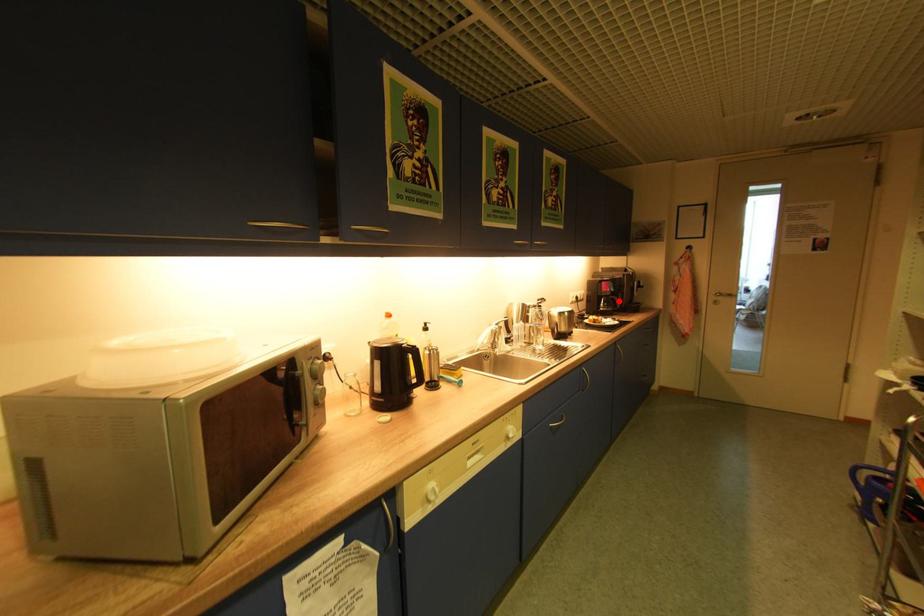
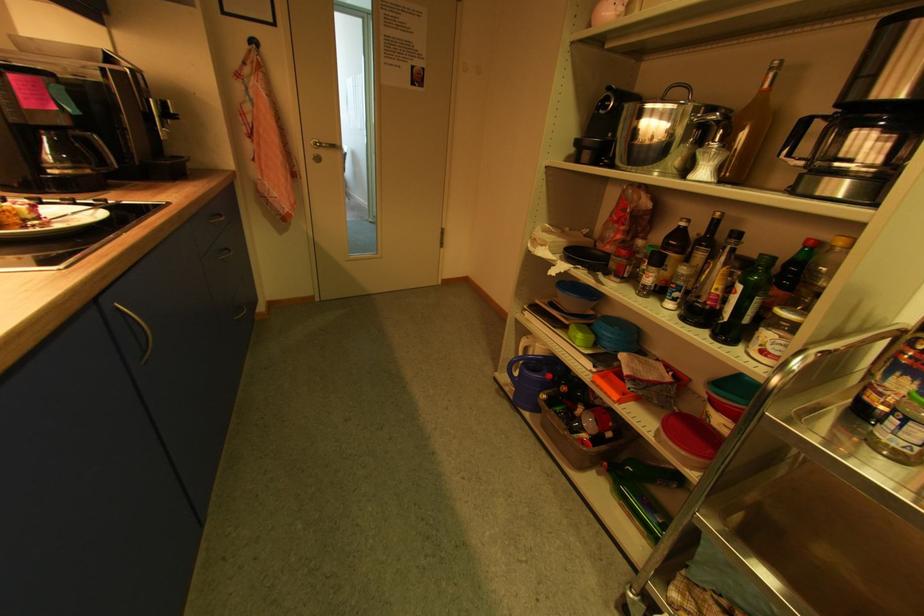
Question: I am providing you with two images of the same scene from different viewpoints. Given a red point in image1, look at the same physical point in image2. Is it:

Choices:
 (A) Closer to the viewpoint
 (B) Farther from the viewpoint

Answer: (B)